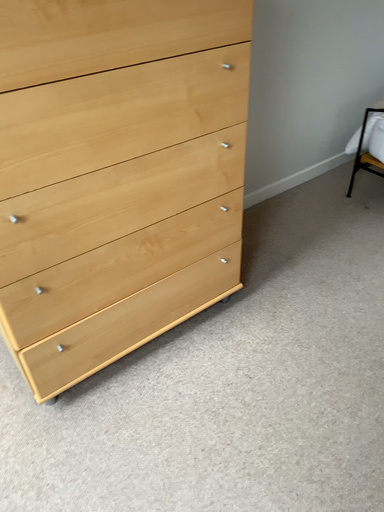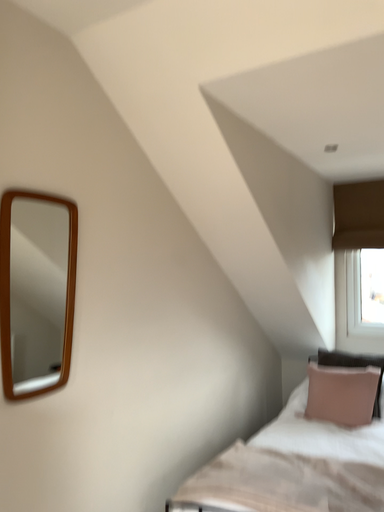
Question: How did the camera likely rotate when shooting the video?

Choices:
 (A) rotated right
 (B) rotated left

Answer: (A)